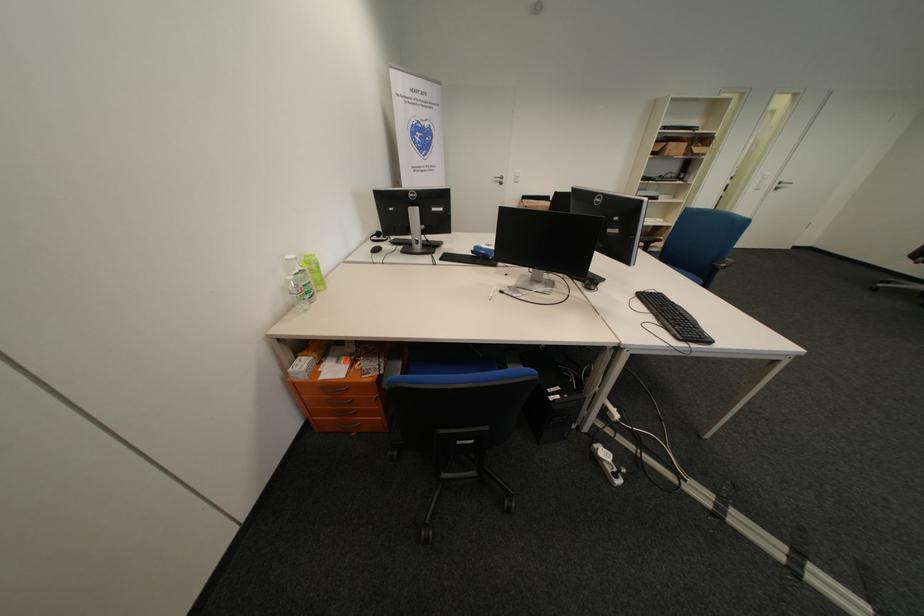
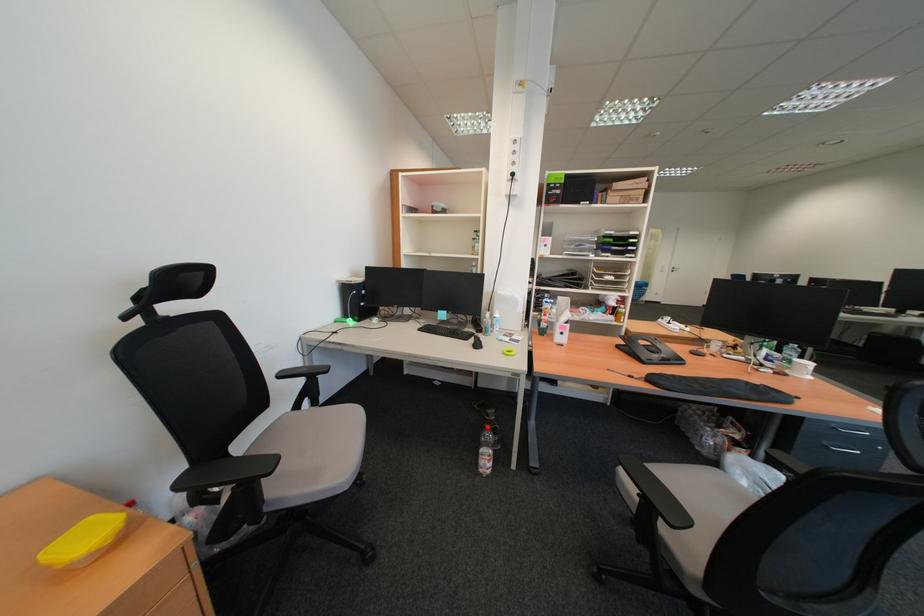
Question: In a continuous first-person perspective shot, in which direction is the camera moving?

Choices:
 (A) Left
 (B) Right
 (C) Forward
 (D) Backward

Answer: (D)